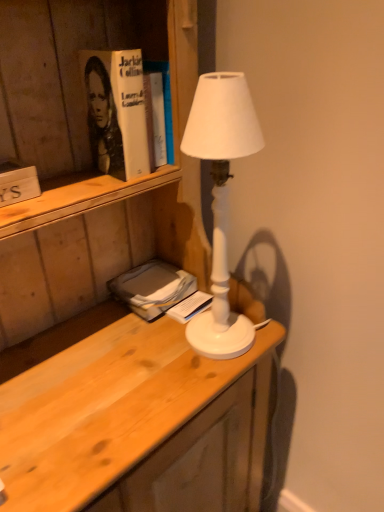
Locate an element on the screen. hardcover book at upper left is located at coordinates (116, 112).

What is the approximate width of white matte lamp at center?

white matte lamp at center is 5.89 inches wide.

What is the approximate width of gray matte book at lower left, the second book from the left?

gray matte book at lower left, the second book from the left, is 6.01 inches wide.

The image size is (384, 512). What are the coordinates of `wooden sign at left, the third book when ordered from right to left` in the screenshot? It's located at click(17, 182).

You are a GUI agent. You are given a task and a screenshot of the screen. Output one action in this format:
    pyautogui.click(x=<x>, y=<y>)
    Task: Click on the lamp in front of the gray matte book at lower left, the second book from the left
    The height and width of the screenshot is (512, 384).
    Given the screenshot: What is the action you would take?
    pyautogui.click(x=221, y=199)

From the image's perspective, which is below, gray matte book at lower left, the 2th book when ordered from bottom to top, or white matte lamp at center?

From the image's view, gray matte book at lower left, the 2th book when ordered from bottom to top, is below.

Considering the sizes of objects gray matte book at lower left, acting as the second book starting from the front, and white matte lamp at center in the image provided, who is shorter, gray matte book at lower left, acting as the second book starting from the front, or white matte lamp at center?

gray matte book at lower left, acting as the second book starting from the front.

From the image's perspective, which one is positioned lower, wooden sign at left, marked as the 1th book in a top-to-bottom arrangement, or wooden desk at center?

wooden desk at center appears lower in the image.

Considering the positions of point (20, 163) and point (150, 355), is point (20, 163) closer or farther from the camera than point (150, 355)?

Clearly, point (20, 163) is closer to the camera than point (150, 355).

Is wooden sign at left, which ranks as the 1th book in front-to-back order, aimed at wooden desk at center?

Yes, wooden sign at left, which ranks as the 1th book in front-to-back order, faces towards wooden desk at center.

Considering the sizes of objects wooden sign at left, the third book when ordered from right to left, and wooden desk at center in the image provided, who is thinner, wooden sign at left, the third book when ordered from right to left, or wooden desk at center?

wooden sign at left, the third book when ordered from right to left, is thinner.

The height and width of the screenshot is (512, 384). What are the coordinates of `the 1st book below when counting from the wooden sign at left, which is the 3th book in back-to-front order (from the image's perspective)` in the screenshot? It's located at (152, 288).

Looking at their sizes, would you say wooden sign at left, which is the 3th book in back-to-front order, is wider or thinner than gray matte book at lower left, the second book from the left?

wooden sign at left, which is the 3th book in back-to-front order, is thinner than gray matte book at lower left, the second book from the left.

Could you tell me if wooden sign at left, which ranks as the 1th book in front-to-back order, is turned towards gray matte book at lower left, the 2th book when ordered from right to left?

No, wooden sign at left, which ranks as the 1th book in front-to-back order, does not turn towards gray matte book at lower left, the 2th book when ordered from right to left.

Is wooden sign at left, which is counted as the first book, starting from the left, bigger or smaller than gray matte book at lower left, the 2th book when ordered from bottom to top?

Clearly, wooden sign at left, which is counted as the first book, starting from the left, is smaller in size than gray matte book at lower left, the 2th book when ordered from bottom to top.

Does wooden desk at center have a greater width compared to white matte lamp at center?

Indeed, wooden desk at center has a greater width compared to white matte lamp at center.

Is wooden desk at center surrounding white matte lamp at center?

Yes, white matte lamp at center is a part of wooden desk at center.

From a real-world perspective, between wooden desk at center and white matte lamp at center, who is vertically lower?

From a 3D spatial view, wooden desk at center is below.

Could you tell me if wooden desk at center is facing white matte lamp at center?

Yes.

How far apart are gray matte book at lower left, acting as the second book starting from the top, and white paper book at center, which is counted as the first book, starting from the bottom?

gray matte book at lower left, acting as the second book starting from the top, is 7.94 centimeters from white paper book at center, which is counted as the first book, starting from the bottom.

Who is more distant, gray matte book at lower left, the 2th book in the back-to-front sequence, or white paper book at center, which is the third book from left to right?

Positioned behind is white paper book at center, which is the third book from left to right.

Is gray matte book at lower left, the second book from the left, located outside white paper book at center, marked as the 1th book in a right-to-left arrangement?

gray matte book at lower left, the second book from the left, is positioned outside white paper book at center, marked as the 1th book in a right-to-left arrangement.

Is white matte lamp at center facing towards white paper book at center, which is counted as the first book, starting from the bottom?

No, white matte lamp at center does not turn towards white paper book at center, which is counted as the first book, starting from the bottom.

Is point (198, 328) positioned before point (180, 318)?

Yes.

Can you tell me how much white matte lamp at center and white paper book at center, which is the third book from top to bottom, differ in facing direction?

white matte lamp at center and white paper book at center, which is the third book from top to bottom, are facing 1.72 degrees away from each other.

Is white matte lamp at center positioned behind white paper book at center, marked as the 1th book in a right-to-left arrangement?

No.

Where is `the 1st book to the left of the white paper book at center, positioned as the third book in front-to-back order, starting your count from the anchor`? The image size is (384, 512). the 1st book to the left of the white paper book at center, positioned as the third book in front-to-back order, starting your count from the anchor is located at coordinates (152, 288).

From a real-world perspective, which object stands above the other?

From a 3D spatial view, gray matte book at lower left, the 2th book when ordered from right to left, is above.

Is white paper book at center, which is counted as the first book, starting from the bottom, oriented away from gray matte book at lower left, the 2th book in the back-to-front sequence?

That's right, white paper book at center, which is counted as the first book, starting from the bottom, is facing away from gray matte book at lower left, the 2th book in the back-to-front sequence.

Can you confirm if white paper book at center, which is counted as the first book, starting from the bottom, is smaller than gray matte book at lower left, acting as the second book starting from the top?

Yes, white paper book at center, which is counted as the first book, starting from the bottom, is smaller than gray matte book at lower left, acting as the second book starting from the top.

From a real-world perspective, count 1st books downward from the white matte lamp at center and point to it. Please provide its 2D coordinates.

[(152, 288)]

Identify the location of the 3rd book directly above the wooden desk at center (from a real-world perspective). (17, 182).

Considering their positions, is gray matte book at lower left, the 2th book in the back-to-front sequence, positioned further to wooden desk at center than white matte lamp at center?

The object further to wooden desk at center is gray matte book at lower left, the 2th book in the back-to-front sequence.

Considering their positions, is white matte lamp at center positioned closer to wooden desk at center than wooden sign at left, marked as the 1th book in a top-to-bottom arrangement?

white matte lamp at center is positioned closer to the anchor wooden desk at center.

Looking at the image, which one is located further to wooden sign at left, marked as the 1th book in a top-to-bottom arrangement, white matte lamp at center or gray matte book at lower left, the 2th book in the back-to-front sequence?

Among the two, gray matte book at lower left, the 2th book in the back-to-front sequence, is located further to wooden sign at left, marked as the 1th book in a top-to-bottom arrangement.

From the image, which object appears to be nearer to wooden desk at center, wooden sign at left, the third book when ordered from right to left, or white matte lamp at center?

The object closer to wooden desk at center is white matte lamp at center.

When comparing their distances from hardcover book at upper left, does wooden sign at left, the third book when ordered from right to left, or white matte lamp at center seem further?

Based on the image, white matte lamp at center appears to be further to hardcover book at upper left.

From the image, which object appears to be farther from white paper book at center, marked as the 1th book in a right-to-left arrangement, gray matte book at lower left, acting as the second book starting from the front, or wooden desk at center?

wooden desk at center is positioned further to the anchor white paper book at center, marked as the 1th book in a right-to-left arrangement.

Consider the image. From the image, which object appears to be nearer to white matte lamp at center, white paper book at center, marked as the 1th book in a right-to-left arrangement, or gray matte book at lower left, the 2th book in the back-to-front sequence?

The object closer to white matte lamp at center is gray matte book at lower left, the 2th book in the back-to-front sequence.

Based on their spatial positions, is wooden sign at left, the third book when ordered from right to left, or gray matte book at lower left, acting as the second book starting from the top, closer to wooden desk at center?

gray matte book at lower left, acting as the second book starting from the top, is closer to wooden desk at center.

Image resolution: width=384 pixels, height=512 pixels. I want to click on lamp between hardcover book at upper left and wooden desk at center from top to bottom, so click(221, 199).

Identify the location of paperback book between wooden sign at left, which is counted as the first book, starting from the left, and white matte lamp at center from left to right. (116, 112).

Locate an element on the screen. This screenshot has width=384, height=512. lamp between hardcover book at upper left and gray matte book at lower left, the 2th book in the back-to-front sequence, in the vertical direction is located at coordinates (221, 199).

You are a GUI agent. You are given a task and a screenshot of the screen. Output one action in this format:
    pyautogui.click(x=<x>, y=<y>)
    Task: Click on the paperback book between wooden desk at center and white paper book at center, which is the third book from left to right, along the z-axis
    This screenshot has height=512, width=384.
    Given the screenshot: What is the action you would take?
    pyautogui.click(x=116, y=112)